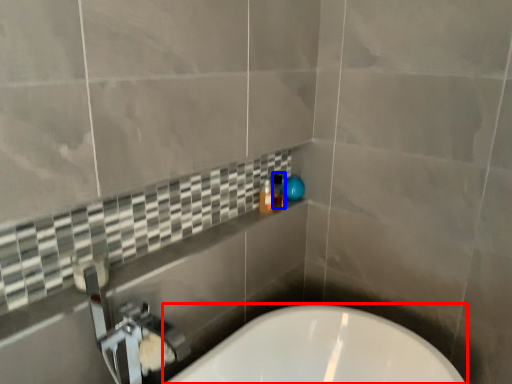
Question: Which of the following is the farthest to the observer, bathtub (highlighted by a red box) or toiletry (highlighted by a blue box)?

Choices:
 (A) bathtub
 (B) toiletry

Answer: (B)